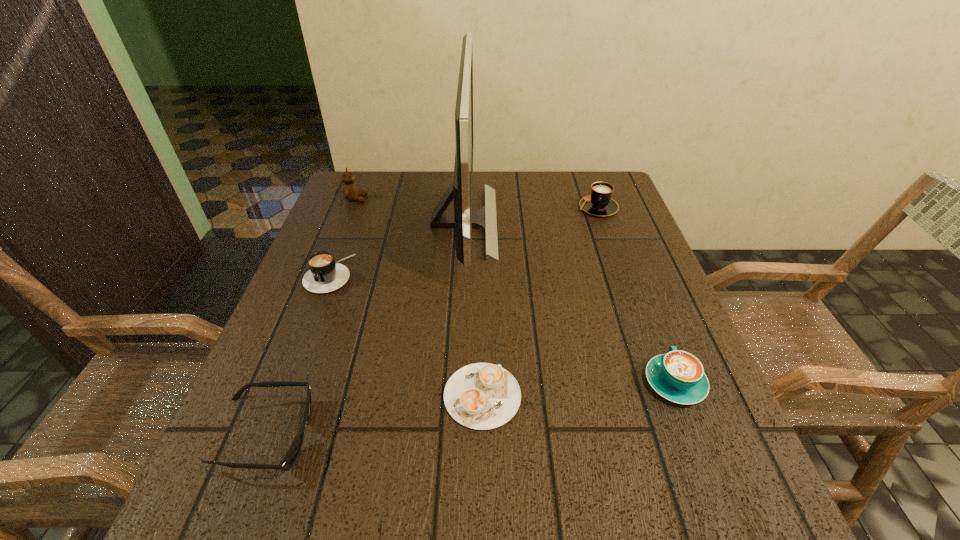
This screenshot has width=960, height=540. Identify the location of vacant region between the leftmost cappuccino and the second shortest cappuccino. (502, 328).

Identify the location of blank region between the monitor and the teddy bear. (410, 211).

Identify the location of blank region between the farthest cappuccino and the second shortest cappuccino. (636, 295).

Locate which object ranks fourth in proximity to the second shortest cappuccino. Please provide its 2D coordinates. Your answer should be formatted as a tuple, i.e. [(x, y)], where the tuple contains the x and y coordinates of a point satisfying the conditions above.

[(289, 459)]

Locate an element on the screen. This screenshot has height=540, width=960. object that is the second closest to the third tallest cappuccino is located at coordinates (463, 219).

Identify which cappuccino is the second closest to the monitor. Please provide its 2D coordinates. Your answer should be formatted as a tuple, i.e. [(x, y)], where the tuple contains the x and y coordinates of a point satisfying the conditions above.

[(482, 396)]

Identify which cappuccino is the nearest to the second shortest cappuccino. Please provide its 2D coordinates. Your answer should be formatted as a tuple, i.e. [(x, y)], where the tuple contains the x and y coordinates of a point satisfying the conditions above.

[(482, 396)]

The width and height of the screenshot is (960, 540). What are the coordinates of `blank space that satisfies the following two spatial constraints: 1. at the face of the teddy bear; 2. on the left side of the farthest cappuccino` in the screenshot? It's located at (353, 208).

Find the location of a particular element. This screenshot has width=960, height=540. vacant space that satisfies the following two spatial constraints: 1. with the handle on the side of the third nearest cappuccino; 2. on the right side of the second cappuccino from left to right is located at coordinates (282, 396).